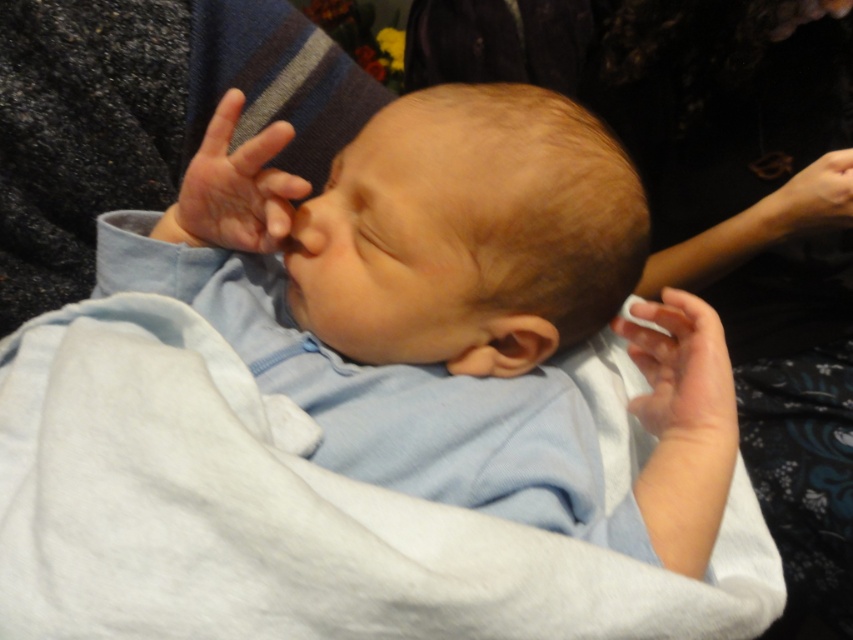
Question: Which point is closer to the camera taking this photo?

Choices:
 (A) (289, 209)
 (B) (693, 388)
 (C) (839, 198)

Answer: (A)

Question: Can you confirm if light blue fabric at center is positioned to the left of white soft blanket at center?

Choices:
 (A) no
 (B) yes

Answer: (A)

Question: Is white soft blanket at center to the right of smooth skin hand at upper right from the viewer's perspective?

Choices:
 (A) no
 (B) yes

Answer: (A)

Question: Which object is closer to the camera taking this photo?

Choices:
 (A) white soft blanket at center
 (B) light blue fabric at center
 (C) smooth flesh nose at center

Answer: (A)

Question: Based on their relative distances, which object is farther from the white matte finger at center?

Choices:
 (A) smooth skin hand at upper right
 (B) smooth skin hand at upper center
 (C) light blue fabric at center
 (D) dark fabric at upper center

Answer: (D)

Question: Is dark fabric at upper center above smooth skin hand at upper center?

Choices:
 (A) no
 (B) yes

Answer: (B)